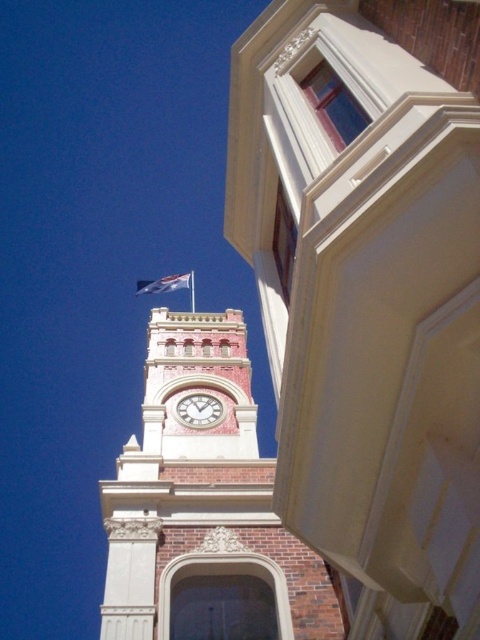
Question: Among these objects, which one is farthest from the camera?

Choices:
 (A) white fabric flag at upper center
 (B) matte pink clock at center

Answer: (A)

Question: Is brick clock tower at center wider than matte pink clock at center?

Choices:
 (A) yes
 (B) no

Answer: (A)

Question: Among these points, which one is farthest from the camera?

Choices:
 (A) (208, 401)
 (B) (193, 522)

Answer: (A)

Question: Is brick clock tower at center to the left of white fabric flag at upper center from the viewer's perspective?

Choices:
 (A) no
 (B) yes

Answer: (A)

Question: In this image, where is matte pink clock at center located relative to white fabric flag at upper center?

Choices:
 (A) left
 (B) right

Answer: (B)

Question: Which point is farther to the camera?

Choices:
 (A) matte pink clock at center
 (B) white fabric flag at upper center

Answer: (B)